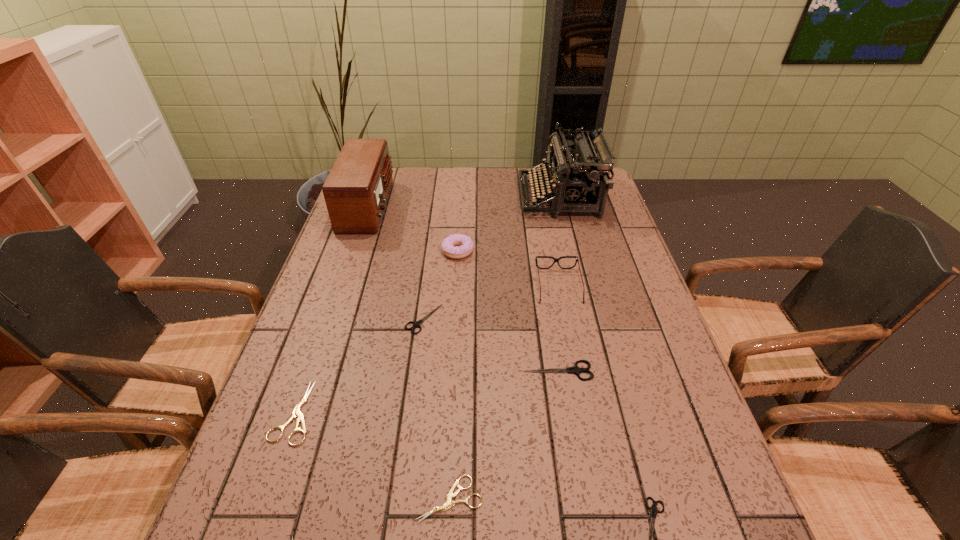
This screenshot has height=540, width=960. I want to click on free spot at the far edge of the desktop, so click(x=468, y=170).

The image size is (960, 540). I want to click on free space at the left edge, so click(352, 268).

This screenshot has width=960, height=540. Find the location of `free location at the right edge`. free location at the right edge is located at coordinates (591, 287).

In order to click on vacant space at the far left corner in this screenshot , I will do `click(390, 198)`.

Where is `free space between the radio receiver and the purple doughnut`? free space between the radio receiver and the purple doughnut is located at coordinates (413, 228).

The image size is (960, 540). Identify the location of vacant space that is in between the second shears from right to left and the doughnut. tap(508, 311).

Locate an element on the screen. This screenshot has width=960, height=540. vacant area between the eighth shortest object and the typewriter is located at coordinates (559, 241).

Find the location of a particular element. This screenshot has width=960, height=540. free spot between the typewriter and the eighth shortest object is located at coordinates (559, 241).

Identify the location of vacant area between the typewriter and the ninth shortest object. This screenshot has height=540, width=960. (464, 202).

This screenshot has height=540, width=960. Identify the location of object that is the third closest to the seventh farthest object. (449, 504).